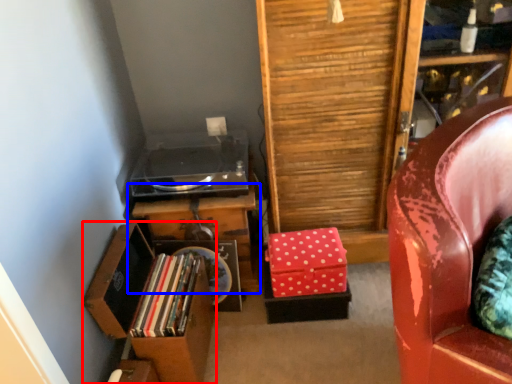
Question: Among these objects, which one is nearest to the camera, file cabinet (highlighted by a red box) or table (highlighted by a blue box)?

Choices:
 (A) file cabinet
 (B) table

Answer: (A)